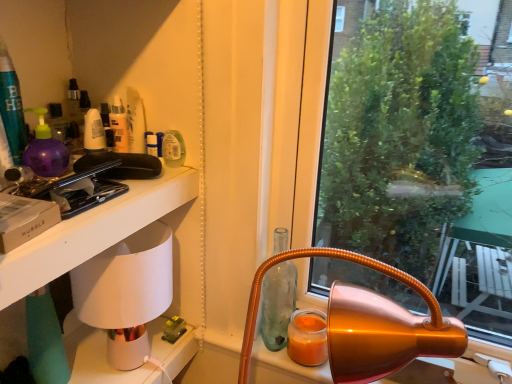
Question: From the image's perspective, does white ceramic lamp at left appear lower than orange matte candle at lower right?

Choices:
 (A) no
 (B) yes

Answer: (A)

Question: Can you confirm if white ceramic lamp at left is positioned to the right of orange matte candle at lower right?

Choices:
 (A) yes
 (B) no

Answer: (B)

Question: Is white ceramic lamp at left looking in the opposite direction of orange matte candle at lower right?

Choices:
 (A) no
 (B) yes

Answer: (A)

Question: Can you confirm if white ceramic lamp at left is smaller than orange matte candle at lower right?

Choices:
 (A) no
 (B) yes

Answer: (A)

Question: Is white ceramic lamp at left in front of orange matte candle at lower right?

Choices:
 (A) yes
 (B) no

Answer: (A)

Question: Would you say transparent glass bottle at center is inside or outside white matte table at left?

Choices:
 (A) outside
 (B) inside

Answer: (A)

Question: Is transparent glass bottle at center taller or shorter than white matte table at left?

Choices:
 (A) tall
 (B) short

Answer: (A)

Question: From the image's perspective, is transparent glass bottle at center above or below white matte table at left?

Choices:
 (A) below
 (B) above

Answer: (A)

Question: Is transparent glass bottle at center wider or thinner than white matte table at left?

Choices:
 (A) thin
 (B) wide

Answer: (A)

Question: Is white matte table at left inside the boundaries of white ceramic lamp at left, or outside?

Choices:
 (A) inside
 (B) outside

Answer: (B)

Question: Considering the positions of point 175,190 and point 167,258, is point 175,190 closer or farther from the camera than point 167,258?

Choices:
 (A) farther
 (B) closer

Answer: (B)

Question: From the image's perspective, relative to white ceramic lamp at left, is white matte table at left above or below?

Choices:
 (A) above
 (B) below

Answer: (A)

Question: Is white matte table at left taller or shorter than white ceramic lamp at left?

Choices:
 (A) short
 (B) tall

Answer: (A)

Question: From the image's perspective, is white ceramic lamp at left positioned above or below white matte table at left?

Choices:
 (A) below
 (B) above

Answer: (A)

Question: Relative to white matte table at left, is white ceramic lamp at left in front or behind?

Choices:
 (A) behind
 (B) front

Answer: (A)